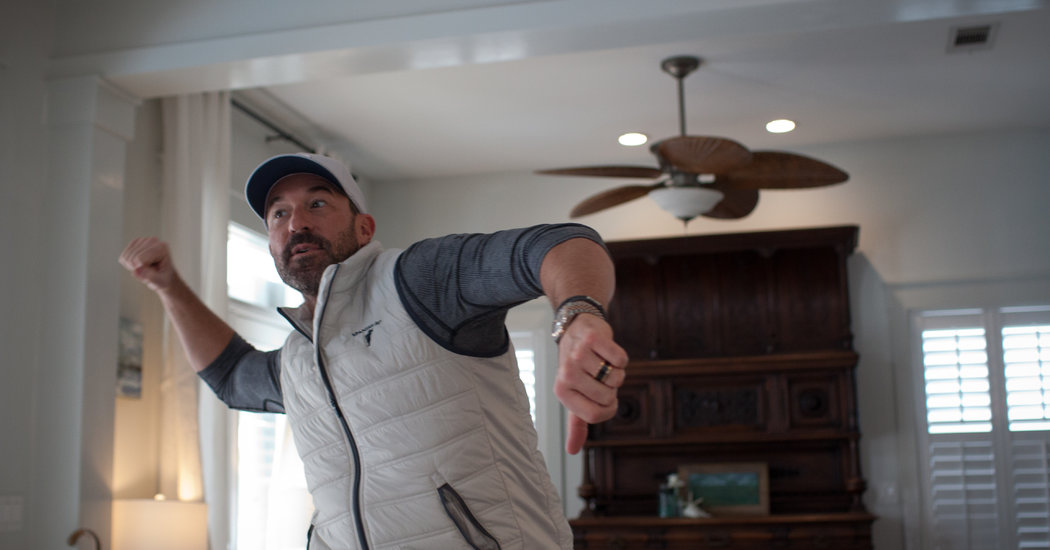
This screenshot has height=550, width=1050. I want to click on brown fan blades, so click(688, 155), click(769, 168), click(742, 203), click(596, 205), click(598, 170).